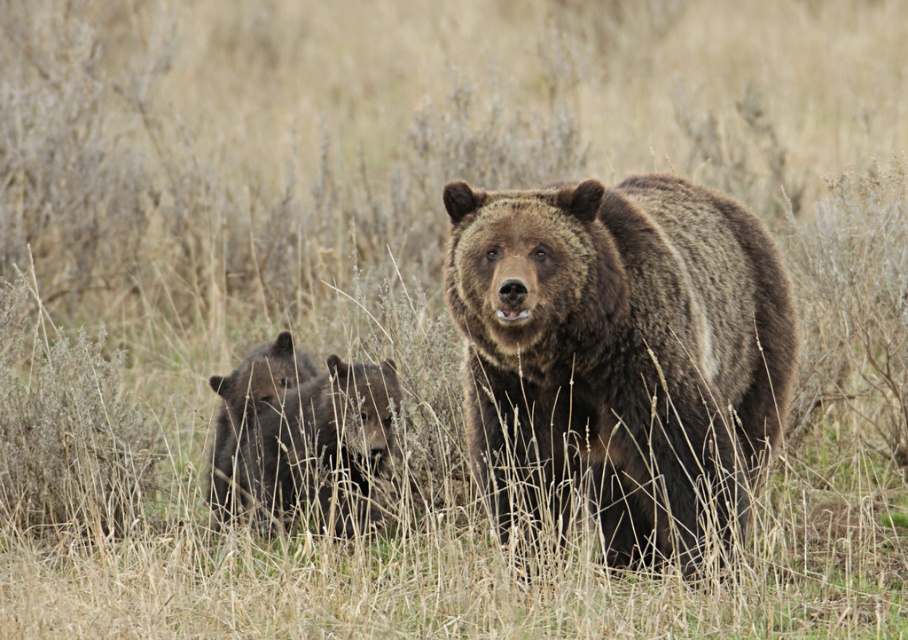
Question: Is brown furry bear at center positioned before shiny black bear at lower left?

Choices:
 (A) no
 (B) yes

Answer: (B)

Question: Does brown furry bear at center have a lesser width compared to shiny black bear at lower left?

Choices:
 (A) yes
 (B) no

Answer: (B)

Question: Is brown furry bear at center further to camera compared to shiny black bear at lower left?

Choices:
 (A) yes
 (B) no

Answer: (B)

Question: Which point appears farthest from the camera in this image?

Choices:
 (A) (209, 490)
 (B) (577, 419)

Answer: (A)

Question: Which point is closer to the camera?

Choices:
 (A) (497, 426)
 (B) (228, 396)

Answer: (A)

Question: Which of the following is the farthest from the observer?

Choices:
 (A) (745, 435)
 (B) (222, 458)

Answer: (B)